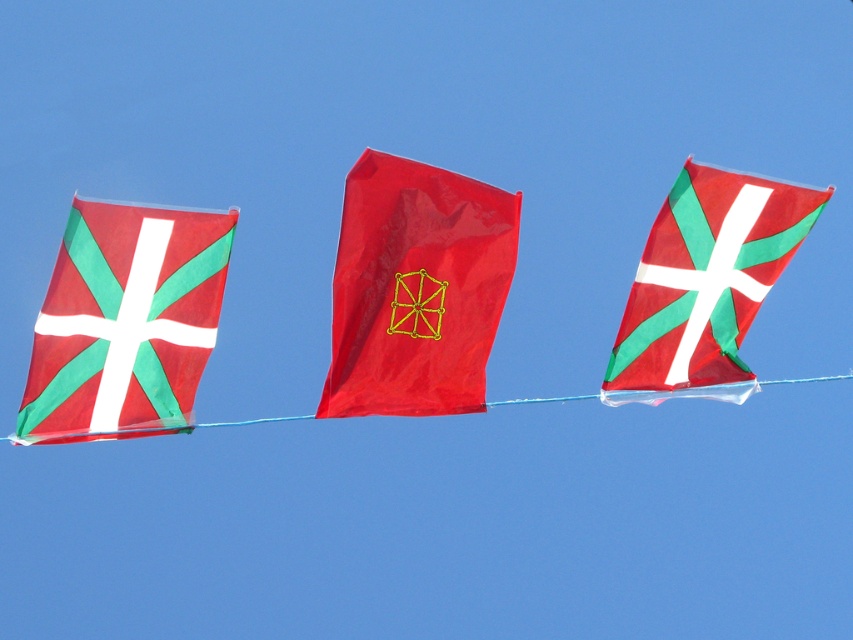
Question: Is matte fabric flag at left to the left of matte red flag at center from the viewer's perspective?

Choices:
 (A) no
 (B) yes

Answer: (B)

Question: Which object is positioned closest to the shiny red flag at center?

Choices:
 (A) matte fabric flag at left
 (B) matte red flag at center

Answer: (B)

Question: Can you confirm if shiny red flag at center is positioned to the right of matte fabric flag at left?

Choices:
 (A) no
 (B) yes

Answer: (B)

Question: Estimate the real-world distances between objects in this image. Which object is closer to the matte red flag at center?

Choices:
 (A) shiny red flag at center
 (B) matte fabric flag at left

Answer: (A)

Question: Among these points, which one is nearest to the camera?

Choices:
 (A) (433, 390)
 (B) (611, 403)
 (C) (172, 218)

Answer: (C)

Question: Is shiny red flag at center to the left of matte red flag at center from the viewer's perspective?

Choices:
 (A) no
 (B) yes

Answer: (B)